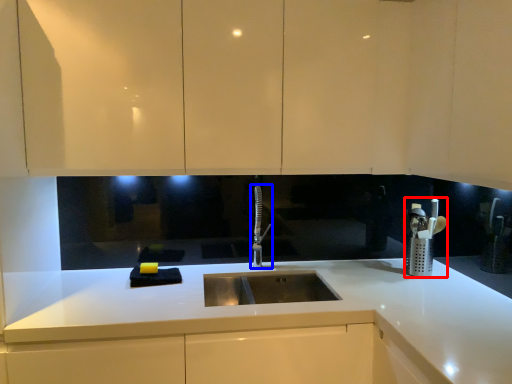
Question: Among these objects, which one is farthest to the camera, appliance (highlighted by a red box) or tap (highlighted by a blue box)?

Choices:
 (A) appliance
 (B) tap

Answer: (A)